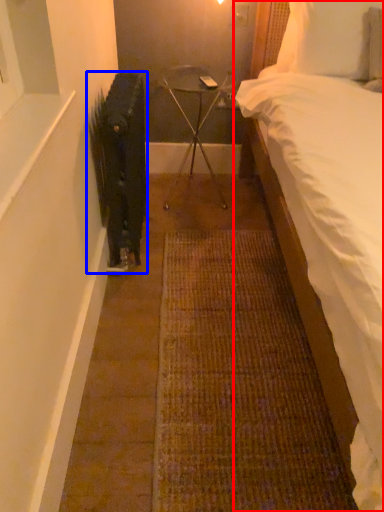
Question: Among these objects, which one is farthest to the camera, bed (highlighted by a red box) or radiator (highlighted by a blue box)?

Choices:
 (A) bed
 (B) radiator

Answer: (B)